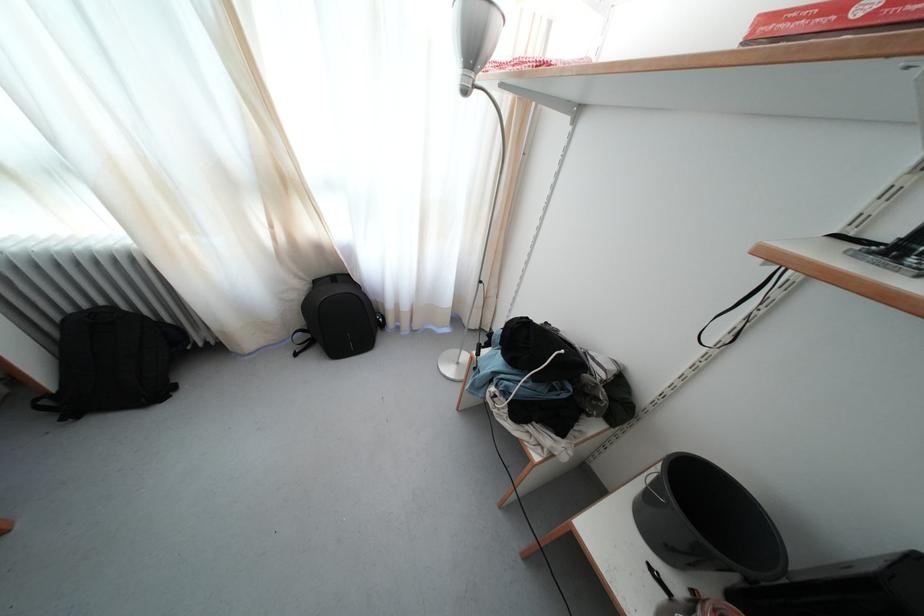
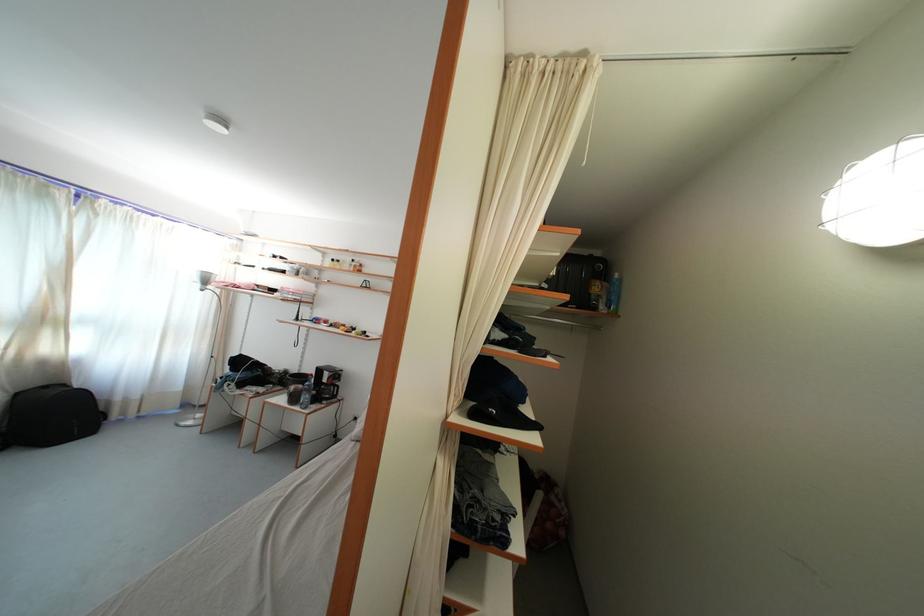
In the second image, find the point that corresponds to (x=322, y=288) in the first image.

(23, 400)